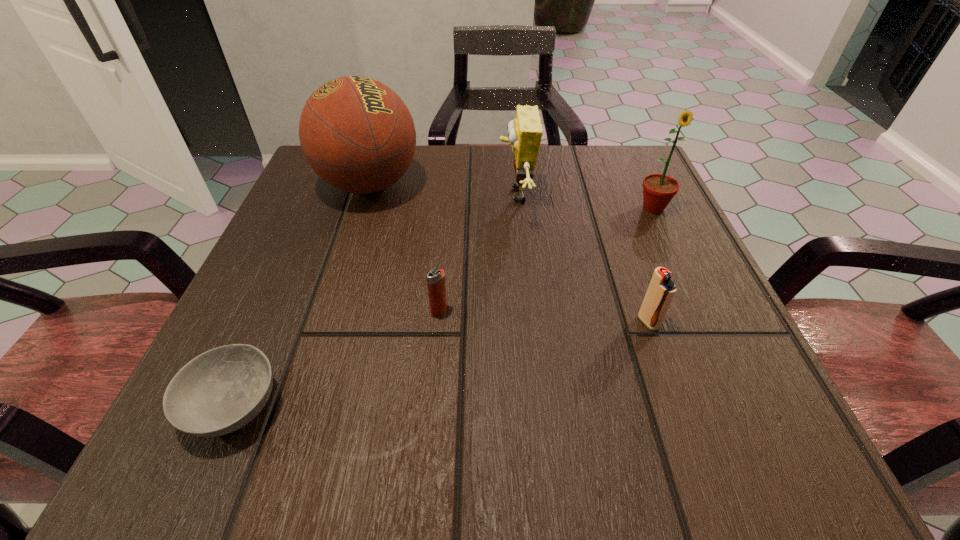
This screenshot has width=960, height=540. I want to click on sponge positioned at the far edge, so click(525, 132).

The image size is (960, 540). What are the coordinates of `object present at the near edge` in the screenshot? It's located at (221, 390).

Locate an element on the screen. This screenshot has height=540, width=960. basketball positioned at the left edge is located at coordinates (356, 133).

Where is `bowl that is at the left edge`? Image resolution: width=960 pixels, height=540 pixels. bowl that is at the left edge is located at coordinates (221, 390).

Find the location of a particular element. The height and width of the screenshot is (540, 960). sunflower that is positioned at the right edge is located at coordinates (658, 189).

I want to click on igniter that is at the right edge, so click(661, 290).

You are a GUI agent. You are given a task and a screenshot of the screen. Output one action in this format:
    pyautogui.click(x=<x>, y=<y>)
    Task: Click on the object at the far left corner
    Image resolution: width=960 pixels, height=540 pixels.
    Given the screenshot: What is the action you would take?
    pyautogui.click(x=356, y=133)

At what (x,y) coordinates should I click in order to perform the action: click on object that is at the near left corner. Please return your answer as a coordinate pair (x, y). The image size is (960, 540). Looking at the image, I should click on (221, 390).

Where is `object located at the far right corner`? This screenshot has width=960, height=540. object located at the far right corner is located at coordinates (658, 189).

Image resolution: width=960 pixels, height=540 pixels. I want to click on vacant space at the far edge, so (550, 176).